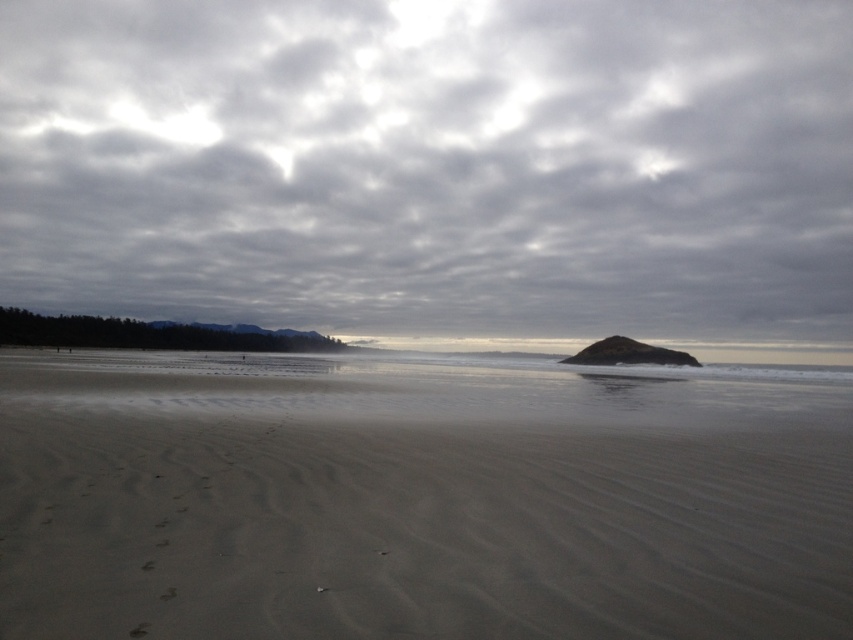
Question: Is cloudy sky at upper center to the left of smooth sand at center from the viewer's perspective?

Choices:
 (A) yes
 (B) no

Answer: (B)

Question: Can you confirm if cloudy sky at upper center is positioned below smooth sand at center?

Choices:
 (A) yes
 (B) no

Answer: (B)

Question: Is cloudy sky at upper center closer to the viewer compared to smooth sand at center?

Choices:
 (A) no
 (B) yes

Answer: (A)

Question: Which point is closer to the camera taking this photo?

Choices:
 (A) click(286, 44)
 (B) click(738, 576)

Answer: (B)

Question: Among these objects, which one is farthest from the camera?

Choices:
 (A) smooth sand at center
 (B) cloudy sky at upper center

Answer: (B)